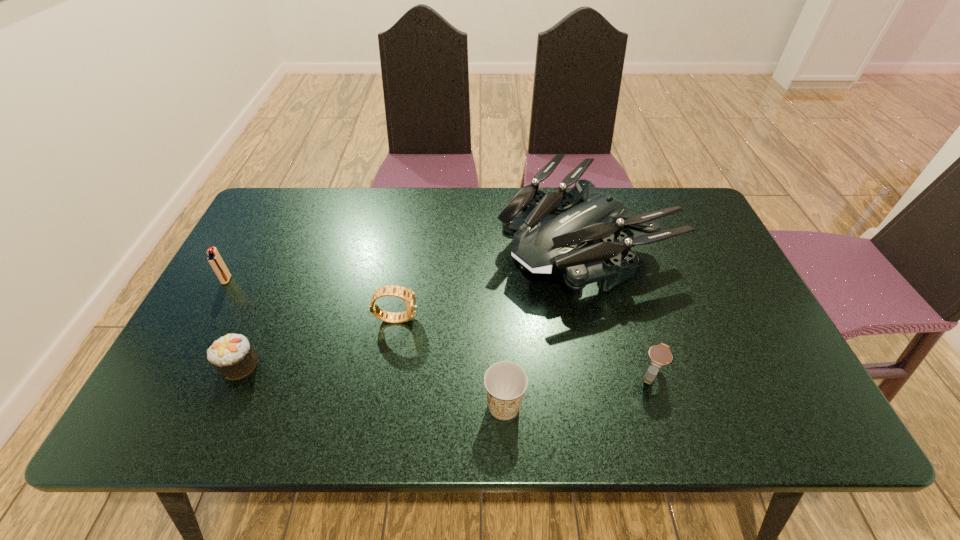
The width and height of the screenshot is (960, 540). Identify the location of drone. (550, 232).

Find the location of `the leftmost object`. the leftmost object is located at coordinates (216, 262).

Find the location of a particular element. Image resolution: width=960 pixels, height=540 pixels. the third object from left to right is located at coordinates (407, 295).

I want to click on the farther watch, so click(x=407, y=295).

At what (x,y) coordinates should I click in order to perform the action: click on Dixie cup. Please return your answer as a coordinate pair (x, y). This screenshot has height=540, width=960. Looking at the image, I should click on (505, 382).

Image resolution: width=960 pixels, height=540 pixels. I want to click on cupcake, so click(232, 355).

Locate an element on the screen. This screenshot has width=960, height=540. the shorter watch is located at coordinates (660, 355).

Locate an element on the screen. The width and height of the screenshot is (960, 540). the nearer watch is located at coordinates (660, 355).

You are a GUI agent. You are given a task and a screenshot of the screen. Output one action in this format:
    pyautogui.click(x=<x>, y=<y>)
    Task: Click on the vacant space located on the left of the tallest object
    
    Given the screenshot: What is the action you would take?
    pyautogui.click(x=365, y=242)

Locate an element on the screen. This screenshot has height=540, width=960. vacant region located 0.260m on the right of the igniter is located at coordinates (328, 280).